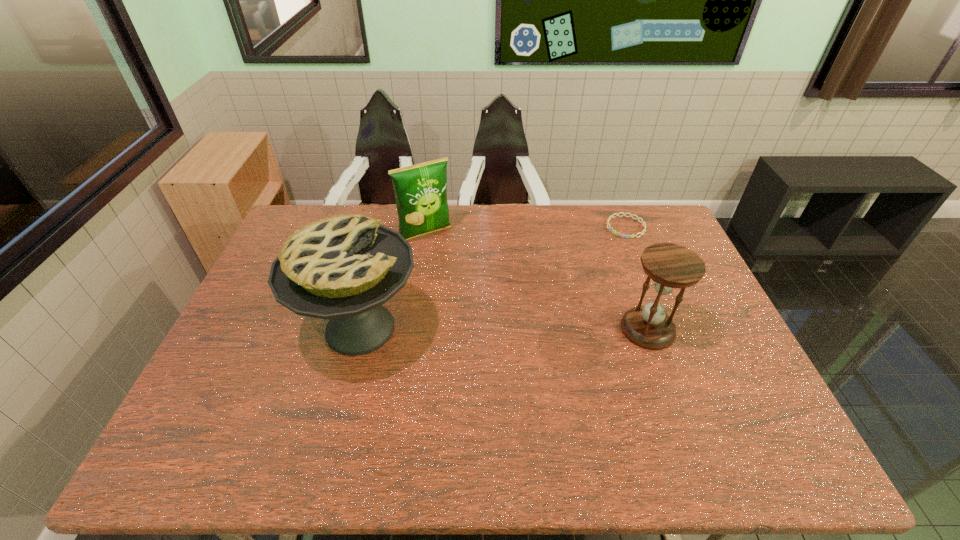
The image size is (960, 540). Find the location of `free spot located 0.050m on the front-facing side of the crisp (potato chip)`. free spot located 0.050m on the front-facing side of the crisp (potato chip) is located at coordinates (442, 252).

Identify the location of vacant position located 0.180m on the front-facing side of the crisp (potato chip). (459, 276).

The width and height of the screenshot is (960, 540). I want to click on bracelet that is at the far edge, so click(x=644, y=225).

At what (x,y) coordinates should I click in order to perform the action: click on crisp (potato chip) that is at the far edge. Please return your answer as a coordinate pair (x, y). Looking at the image, I should click on (420, 190).

Locate an element on the screen. hourglass that is at the right edge is located at coordinates (670, 266).

This screenshot has height=540, width=960. Identify the location of bracelet that is at the right edge. (644, 225).

The image size is (960, 540). What are the coordinates of `object that is at the far right corner` in the screenshot? It's located at (644, 225).

Image resolution: width=960 pixels, height=540 pixels. I want to click on free space at the far edge, so click(x=471, y=222).

The image size is (960, 540). Find the location of `free space at the near edge of the desktop`. free space at the near edge of the desktop is located at coordinates (283, 405).

Where is `free space at the left edge of the desktop`? This screenshot has height=540, width=960. free space at the left edge of the desktop is located at coordinates (232, 356).